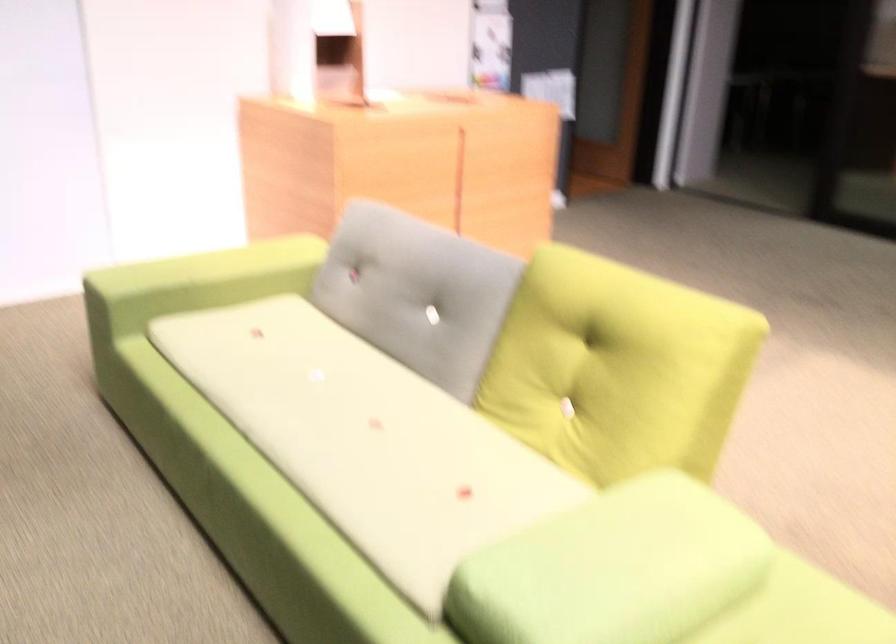
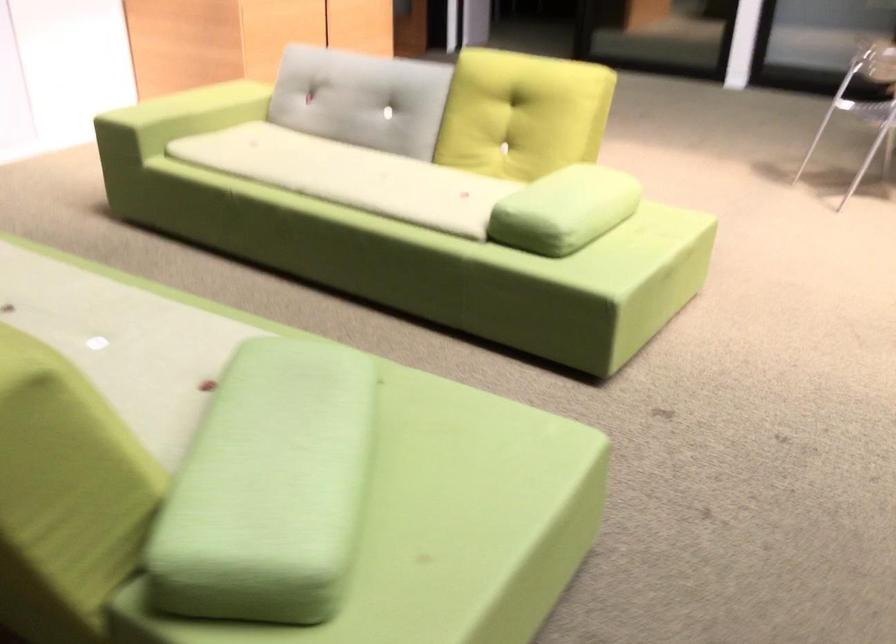
The images are taken continuously from a first-person perspective. In which direction are you moving?

The movement direction of the cameraman is left, backward.